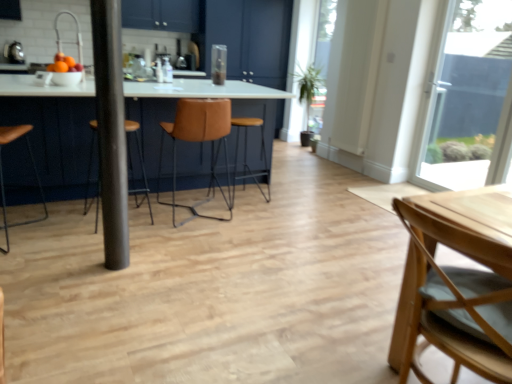
Image resolution: width=512 pixels, height=384 pixels. Identify the location of vacant space in between leather at center, which ranks as the second chair in right-to-left order, and metallic pole at center. (167, 233).